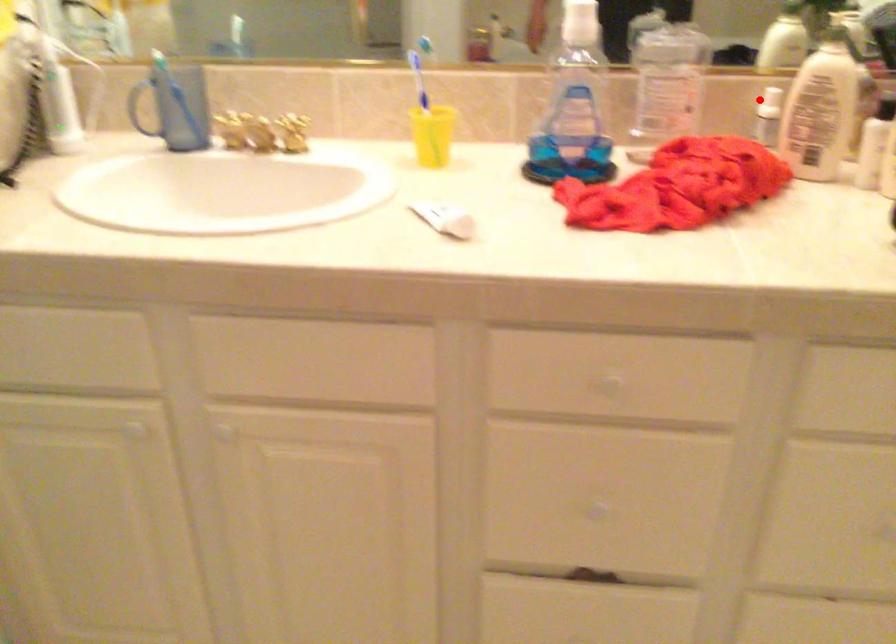
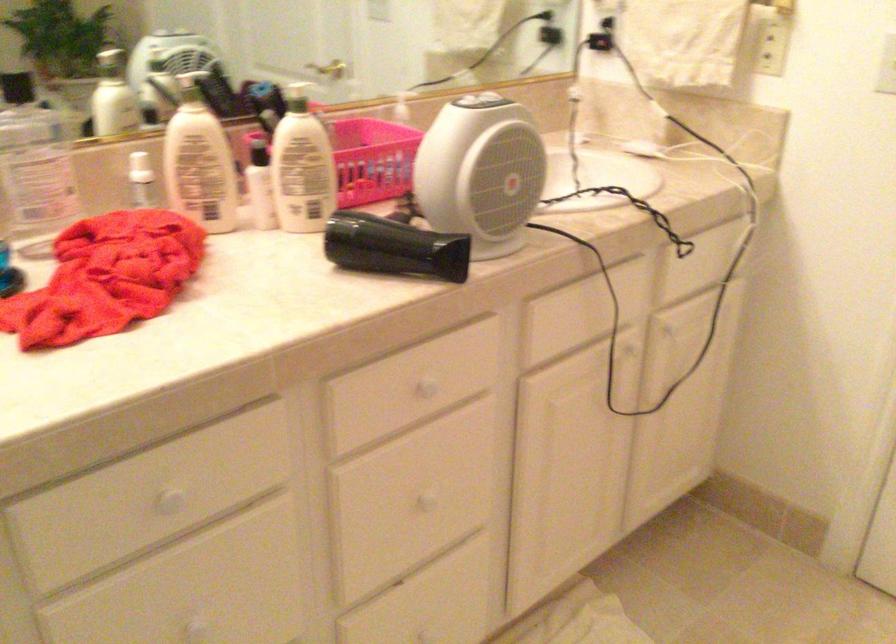
The point at the highlighted location is marked in the first image. Where is the corresponding point in the second image?

(140, 167)